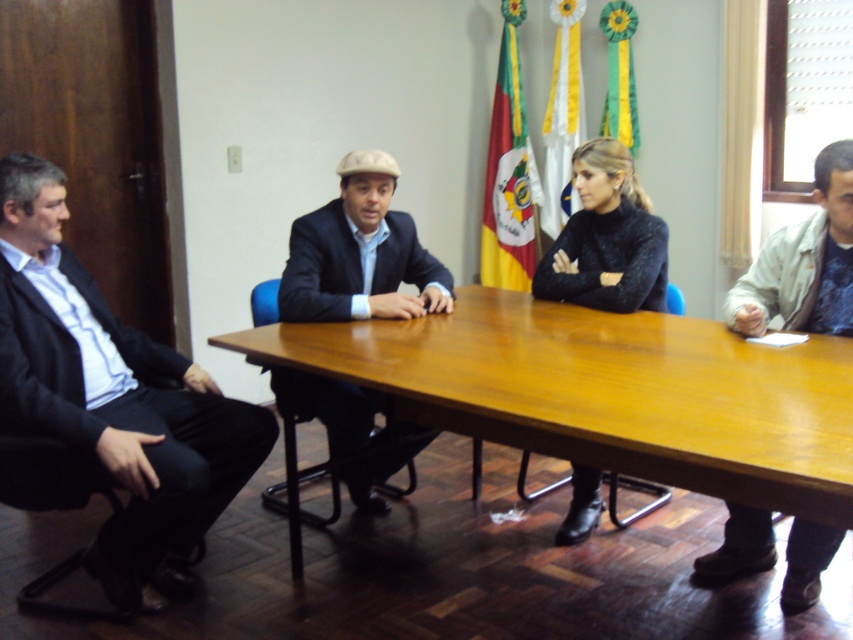
Does point (180, 580) lie in front of point (839, 262)?

No, it is not.

Between point (152, 392) and point (767, 538), which one is positioned in front?

Point (152, 392)

This screenshot has width=853, height=640. What are the coordinates of `dark blue suit at left` in the screenshot? It's located at (112, 397).

Looking at this image, is wooden at center wider than black fuzzy sweater at center?

Yes, wooden at center is wider than black fuzzy sweater at center.

What do you see at coordinates (604, 392) in the screenshot? The height and width of the screenshot is (640, 853). I see `wooden at center` at bounding box center [604, 392].

Which is in front, point (550, 394) or point (605, 204)?

Point (550, 394) is in front.

Image resolution: width=853 pixels, height=640 pixels. Identify the location of wooden at center. (604, 392).

Does dark blue suit at center appear over black fuzzy sweater at center?

Incorrect, dark blue suit at center is not positioned above black fuzzy sweater at center.

Which of these two, dark blue suit at center or black fuzzy sweater at center, stands shorter?

Standing shorter between the two is black fuzzy sweater at center.

Does point (386, 296) come in front of point (607, 209)?

Yes, it is in front of point (607, 209).

Image resolution: width=853 pixels, height=640 pixels. I want to click on dark blue suit at center, so click(x=360, y=253).